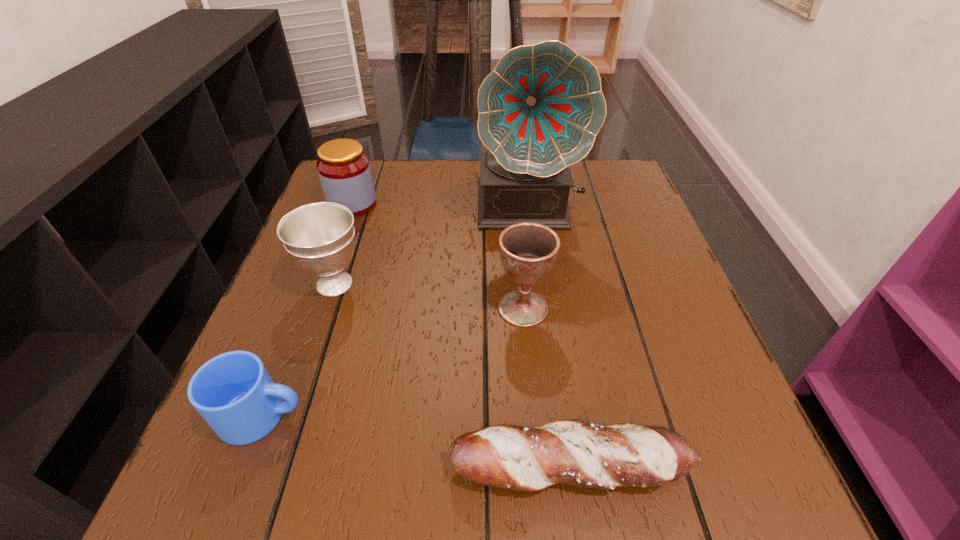
The width and height of the screenshot is (960, 540). Find the location of `free space located on the side of the second shortest object with the handle`. free space located on the side of the second shortest object with the handle is located at coordinates (430, 415).

Image resolution: width=960 pixels, height=540 pixels. Identify the location of vacant area located 0.220m on the back of the baguet. (549, 321).

The image size is (960, 540). In order to click on record player located at the far edge in this screenshot , I will do `click(539, 111)`.

Identify the location of jar present at the far edge. This screenshot has width=960, height=540. (344, 170).

Image resolution: width=960 pixels, height=540 pixels. I want to click on object located at the near edge, so click(x=573, y=452).

I want to click on chalice present at the left edge, so click(319, 237).

What are the coordinates of `jar that is at the left edge` in the screenshot? It's located at (344, 170).

You are a GUI agent. You are given a task and a screenshot of the screen. Output one action in this format:
    pyautogui.click(x=<x>, y=<y>)
    Task: Click on the mug that is at the left edge
    Image resolution: width=960 pixels, height=540 pixels.
    Given the screenshot: What is the action you would take?
    pyautogui.click(x=233, y=392)

I want to click on record player present at the right edge, so click(x=539, y=111).

This screenshot has height=540, width=960. What are the coordinates of `baguet at the right edge` in the screenshot? It's located at point(573,452).